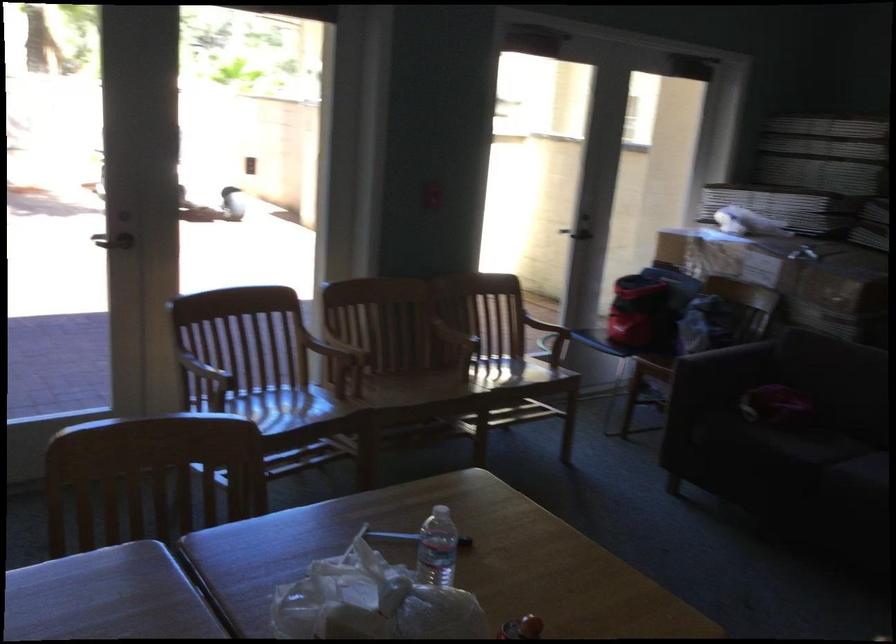
Describe the element at coordinates (843, 392) in the screenshot. This screenshot has width=896, height=644. I see `a sofa sitting surface` at that location.